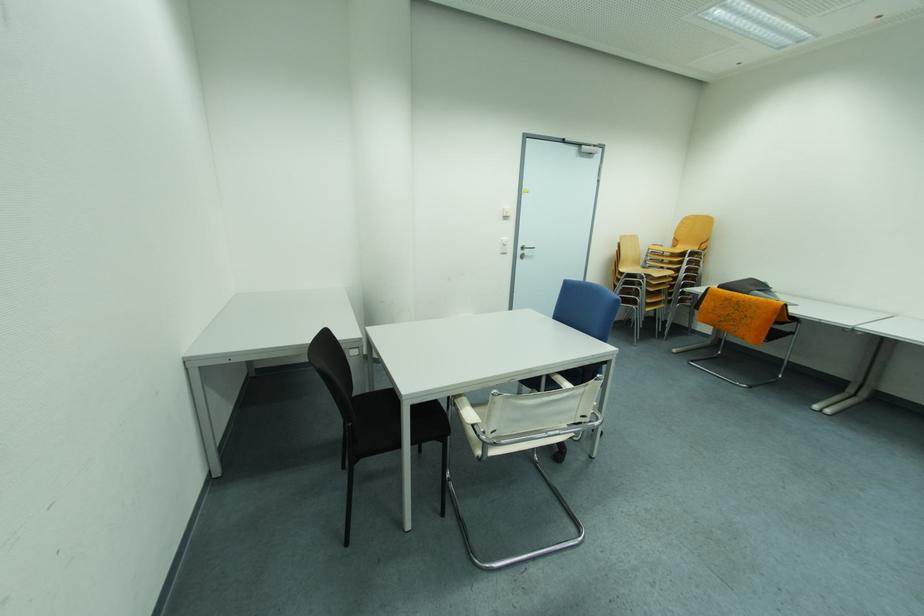
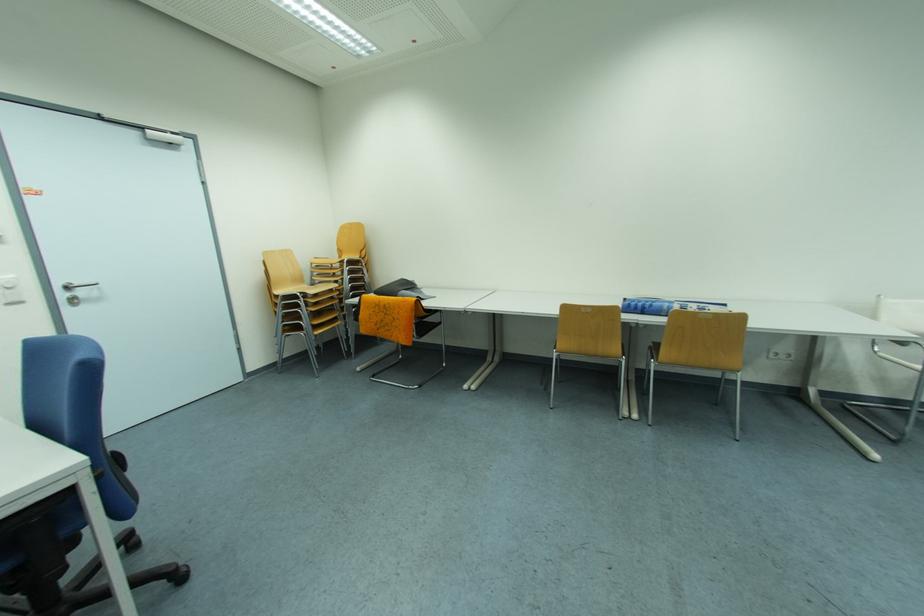
In the second image, find the point that corresponds to pixel 711 308 in the first image.

(369, 318)